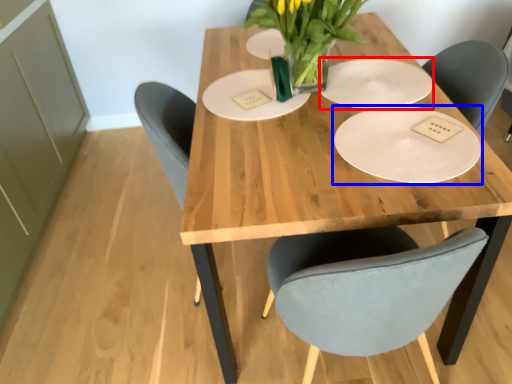
Question: Which object is closer to the camera taking this photo, paper plate (highlighted by a red box) or plate (highlighted by a blue box)?

Choices:
 (A) paper plate
 (B) plate

Answer: (B)